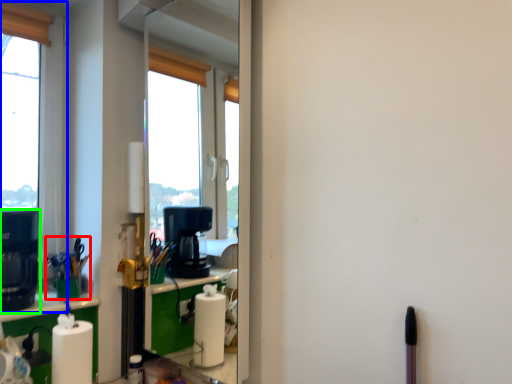
Question: Which object is the closest to the stationery (highlighted by a red box)? Choose among these: window (highlighted by a blue box) or coffee machine (highlighted by a green box).

Choices:
 (A) window
 (B) coffee machine

Answer: (B)